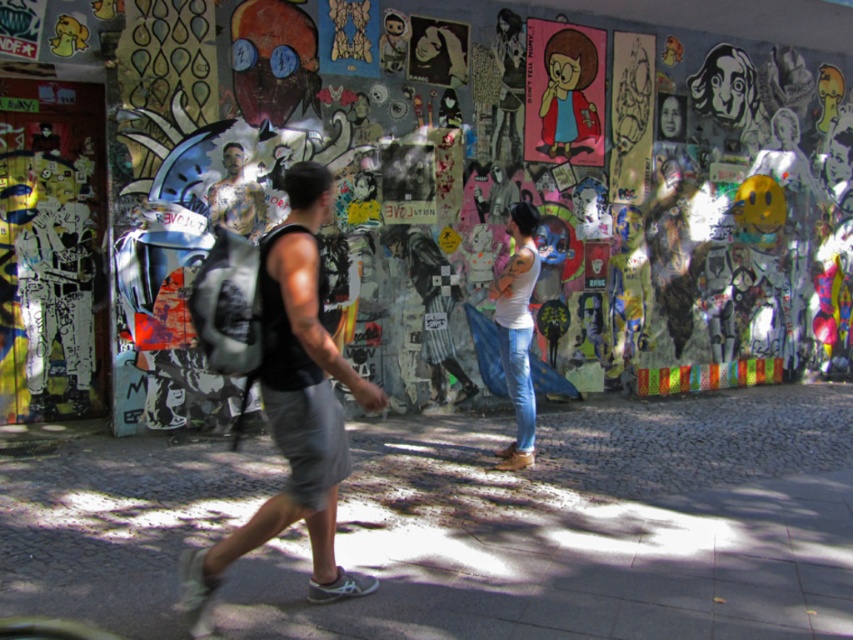
Question: Is matte black backpack at left below black fabric backpack at center?

Choices:
 (A) no
 (B) yes

Answer: (A)

Question: Is matte black backpack at left further to the viewer compared to black fabric backpack at center?

Choices:
 (A) no
 (B) yes

Answer: (B)

Question: Where is matte black backpack at left located in relation to black fabric backpack at center in the image?

Choices:
 (A) right
 (B) left

Answer: (A)

Question: Which object is closer to the camera taking this photo?

Choices:
 (A) black fabric backpack at center
 (B) matte black backpack at left

Answer: (A)

Question: Which object appears farthest from the camera in this image?

Choices:
 (A) black fabric backpack at center
 (B) matte black backpack at left

Answer: (B)